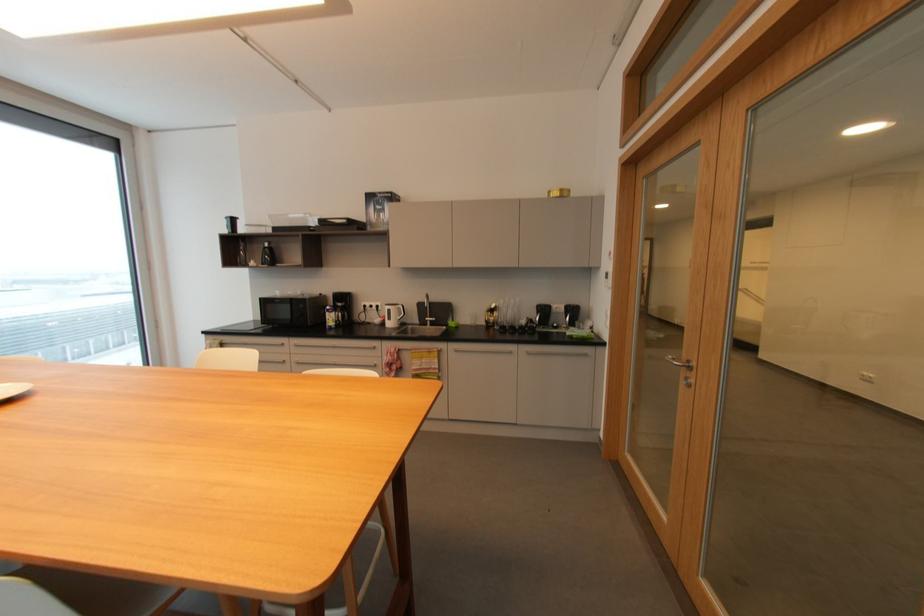
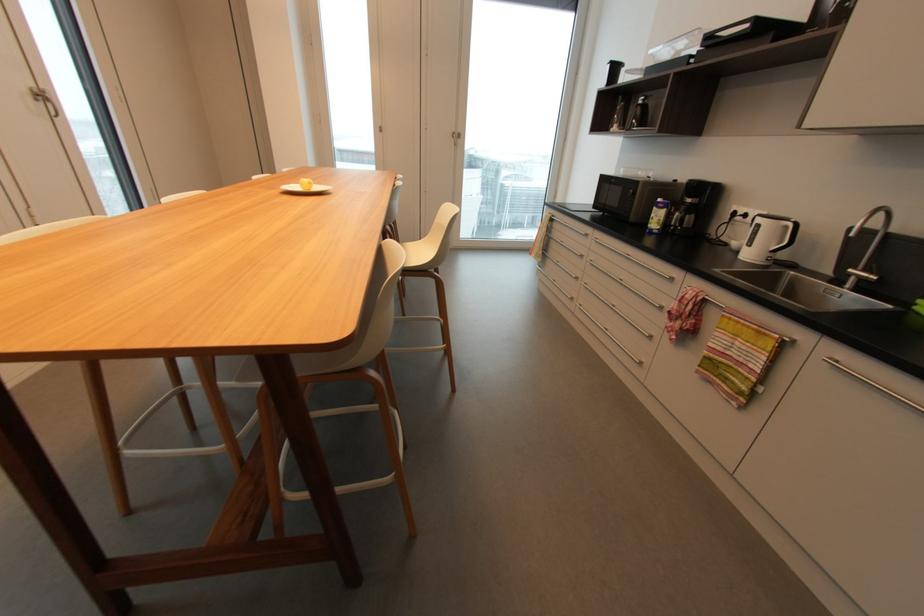
Find the pixel in the second image that matches [403,308] in the first image.

(789, 227)